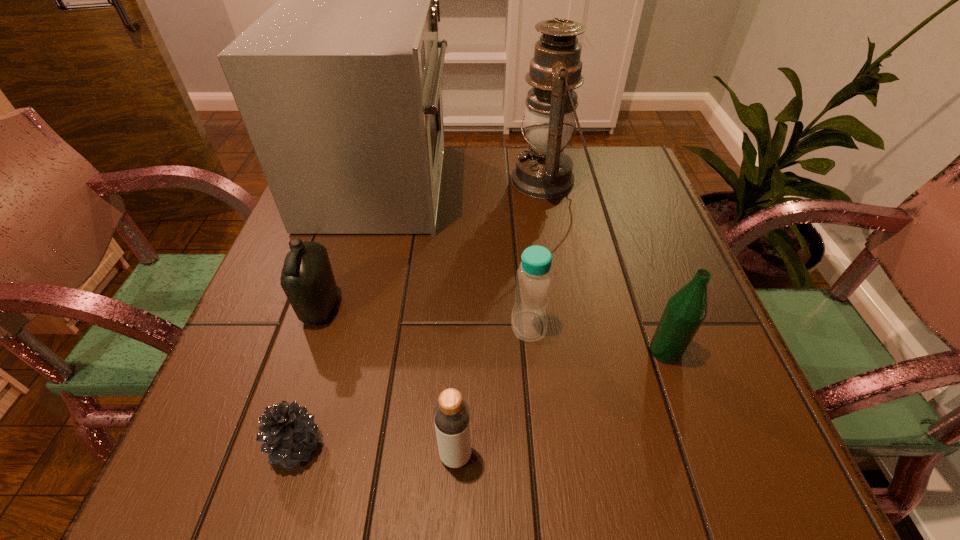
I want to click on toaster oven, so click(338, 84).

This screenshot has width=960, height=540. I want to click on oil lamp, so 544,171.

Identify the location of the rightmost object. (685, 311).

Where is `the third bottle from left to right`? Image resolution: width=960 pixels, height=540 pixels. the third bottle from left to right is located at coordinates (534, 278).

You are a GUI agent. You are given a task and a screenshot of the screen. Output one action in this format:
    pyautogui.click(x=<x>, y=<y>)
    Task: Click on the leftmost bottle
    
    Given the screenshot: What is the action you would take?
    pyautogui.click(x=307, y=279)

At what (x,y) coordinates should I click in order to perform the action: click on the nearest bottle. Please return your answer as a coordinate pair (x, y). Looking at the image, I should click on (451, 414).

This screenshot has height=540, width=960. Find the location of `the third bottle from right to left`. the third bottle from right to left is located at coordinates (x=451, y=414).

Image resolution: width=960 pixels, height=540 pixels. Find the location of `pinecone`. pinecone is located at coordinates (288, 431).

At what (x,y) coordinates should I click in order to perform the action: click on free space located 0.400m on the front panel of the toaster oven. Please return your answer as a coordinate pair (x, y). The height and width of the screenshot is (540, 960). Looking at the image, I should click on (x=608, y=185).

The height and width of the screenshot is (540, 960). Identify the location of free space located 0.080m on the front of the oil lamp. (556, 232).